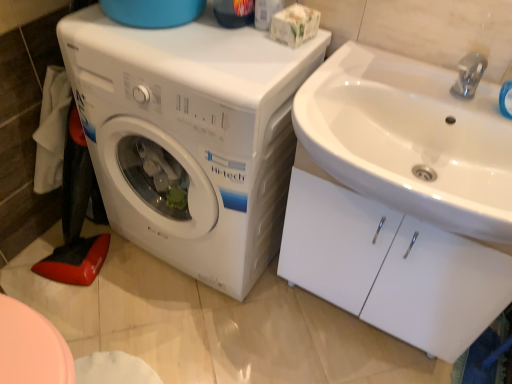
This screenshot has height=384, width=512. In order to click on vacant space that's between white glossy sink at upper right and white plastic washing machine at left in this screenshot , I will do `click(314, 332)`.